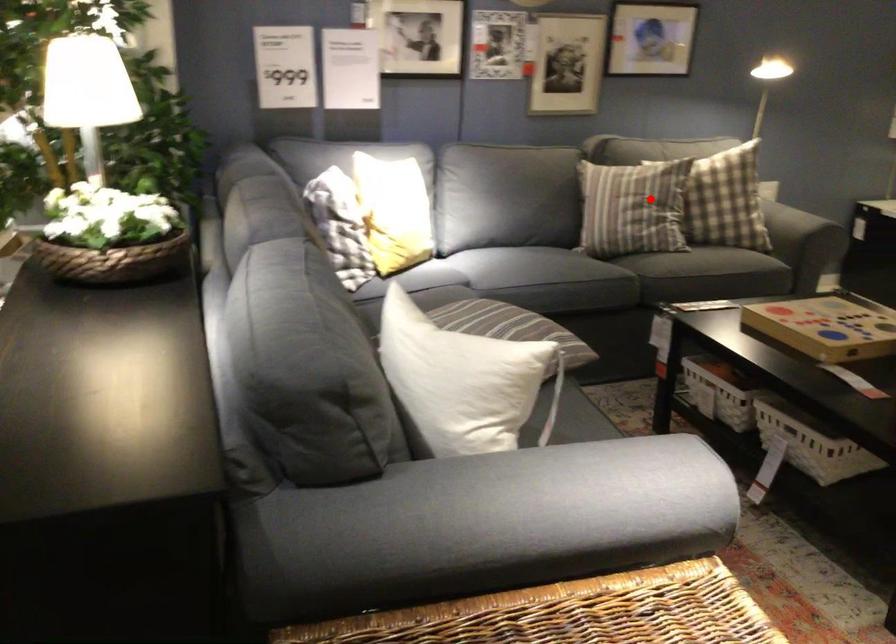
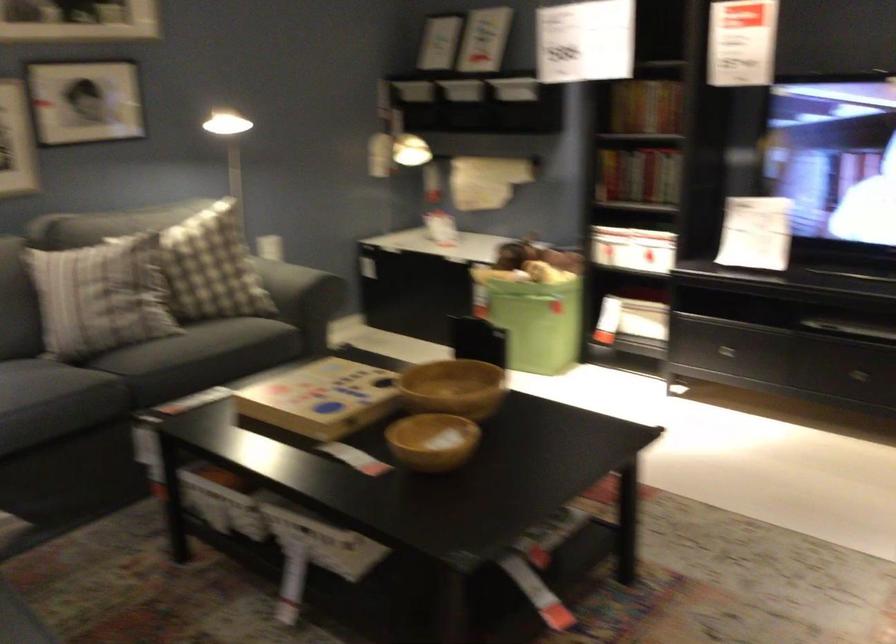
Question: I am providing you with two images of the same scene from different viewpoints. A red point is shown in image1. For the corresponding object point in image2, is it positioned nearer or farther from the camera?

Choices:
 (A) Nearer
 (B) Farther

Answer: (A)